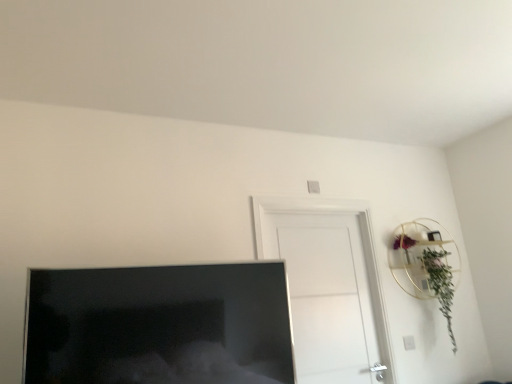
Where is `matte black tv at lower left`? This screenshot has width=512, height=384. matte black tv at lower left is located at coordinates (160, 325).

In the image, there is a green leafy plant at upper right. At what (x,y) coordinates should I click in order to perform the action: click on door above it (from the image's perspective). Please return your answer as a coordinate pair (x, y). The height and width of the screenshot is (384, 512). Looking at the image, I should click on (329, 297).

From the image's perspective, relative to white matte door at center, is green leafy plant at upper right above or below?

From the image's perspective, green leafy plant at upper right appears below white matte door at center.

Which object is positioned more to the right, green leafy plant at upper right or white matte door at center?

Positioned to the right is green leafy plant at upper right.

Can you confirm if matte black tv at lower left is positioned to the left of green leafy plant at upper right?

Correct, you'll find matte black tv at lower left to the left of green leafy plant at upper right.

Considering the relative sizes of matte black tv at lower left and green leafy plant at upper right in the image provided, is matte black tv at lower left wider than green leafy plant at upper right?

In fact, matte black tv at lower left might be narrower than green leafy plant at upper right.

Considering the sizes of matte black tv at lower left and green leafy plant at upper right in the image, is matte black tv at lower left taller or shorter than green leafy plant at upper right?

In the image, matte black tv at lower left appears to be shorter than green leafy plant at upper right.

How distant is matte black tv at lower left from green leafy plant at upper right?

5.83 feet.

From a real-world perspective, is white matte door at center above or below matte black tv at lower left?

In terms of real-world spatial position, white matte door at center is above matte black tv at lower left.

Would you say white matte door at center is inside or outside matte black tv at lower left?

white matte door at center is located beyond the bounds of matte black tv at lower left.

Considering the relative sizes of white matte door at center and matte black tv at lower left in the image provided, is white matte door at center taller than matte black tv at lower left?

Indeed, white matte door at center has a greater height compared to matte black tv at lower left.

Would you say white matte door at center is a long distance from matte black tv at lower left?

No, white matte door at center is in close proximity to matte black tv at lower left.

Considering the relative sizes of matte black tv at lower left and white matte door at center in the image provided, is matte black tv at lower left thinner than white matte door at center?

No, matte black tv at lower left is not thinner than white matte door at center.

Is matte black tv at lower left facing away from white matte door at center?

No, white matte door at center is not at the back of matte black tv at lower left.

From the image's perspective, is matte black tv at lower left above or below white matte door at center?

Based on their image positions, matte black tv at lower left is located above white matte door at center.

Is matte black tv at lower left positioned behind white matte door at center?

No, it is not.

Is green leafy plant at upper right inside or outside of matte black tv at lower left?

green leafy plant at upper right is located beyond the bounds of matte black tv at lower left.

Between green leafy plant at upper right and matte black tv at lower left, which one has more height?

With more height is green leafy plant at upper right.

Is green leafy plant at upper right at the left side of matte black tv at lower left?

No.

Can you confirm if green leafy plant at upper right is bigger than matte black tv at lower left?

No, green leafy plant at upper right is not bigger than matte black tv at lower left.

Is white matte door at center turned away from green leafy plant at upper right?

white matte door at center does not have its back to green leafy plant at upper right.

Between point (352, 290) and point (434, 254), which one is positioned behind?

Positioned behind is point (434, 254).

Considering their positions, is white matte door at center located in front of or behind green leafy plant at upper right?

In the image, white matte door at center appears in front of green leafy plant at upper right.

Does white matte door at center have a larger size compared to green leafy plant at upper right?

Indeed, white matte door at center has a larger size compared to green leafy plant at upper right.

This screenshot has width=512, height=384. I want to click on plant below the white matte door at center (from the image's perspective), so click(x=440, y=283).

Find the location of a particular element. The height and width of the screenshot is (384, 512). plant behind the matte black tv at lower left is located at coordinates point(440,283).

Based on their spatial positions, is white matte door at center or green leafy plant at upper right further from matte black tv at lower left?

green leafy plant at upper right.

When comparing their distances from green leafy plant at upper right, does matte black tv at lower left or white matte door at center seem closer?

Among the two, white matte door at center is located nearer to green leafy plant at upper right.

Based on their spatial positions, is green leafy plant at upper right or white matte door at center closer to matte black tv at lower left?

Based on the image, white matte door at center appears to be nearer to matte black tv at lower left.

From the image, which object appears to be nearer to white matte door at center, matte black tv at lower left or green leafy plant at upper right?

The object closer to white matte door at center is green leafy plant at upper right.

Considering their positions, is white matte door at center positioned further to green leafy plant at upper right than matte black tv at lower left?

Among the two, matte black tv at lower left is located further to green leafy plant at upper right.

When comparing their distances from white matte door at center, does green leafy plant at upper right or matte black tv at lower left seem further?

Based on the image, matte black tv at lower left appears to be further to white matte door at center.

Locate an element on the screen. Image resolution: width=512 pixels, height=384 pixels. door situated between matte black tv at lower left and green leafy plant at upper right from left to right is located at coordinates (329, 297).